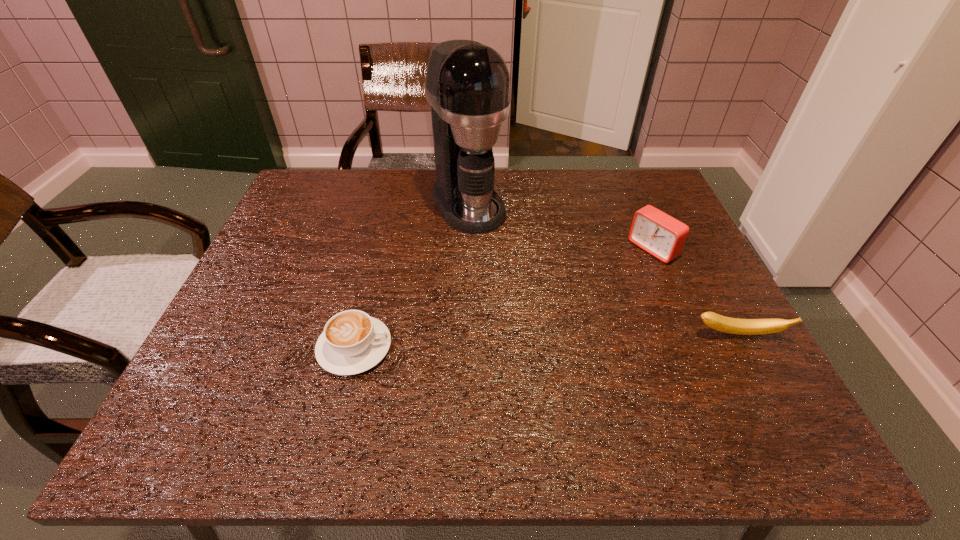
Where is `vacant area that lies between the banana and the alarm clock`? Image resolution: width=960 pixels, height=540 pixels. vacant area that lies between the banana and the alarm clock is located at coordinates [x=695, y=292].

Locate an element on the screen. free space between the banana and the cappuccino is located at coordinates (546, 341).

Identify the location of empty space between the cappuccino and the banana. Image resolution: width=960 pixels, height=540 pixels. (546, 341).

Where is `object that stands as the second closest to the coffee maker`? The width and height of the screenshot is (960, 540). object that stands as the second closest to the coffee maker is located at coordinates (659, 234).

Identify which object is the third closest to the leftmost object. Please provide its 2D coordinates. Your answer should be formatted as a tuple, i.e. [(x, y)], where the tuple contains the x and y coordinates of a point satisfying the conditions above.

[(715, 321)]